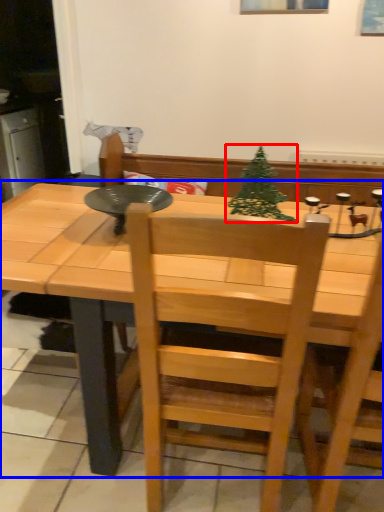
Question: Among these objects, which one is farthest to the camera, christmas tree (highlighted by a red box) or table (highlighted by a blue box)?

Choices:
 (A) christmas tree
 (B) table

Answer: (A)